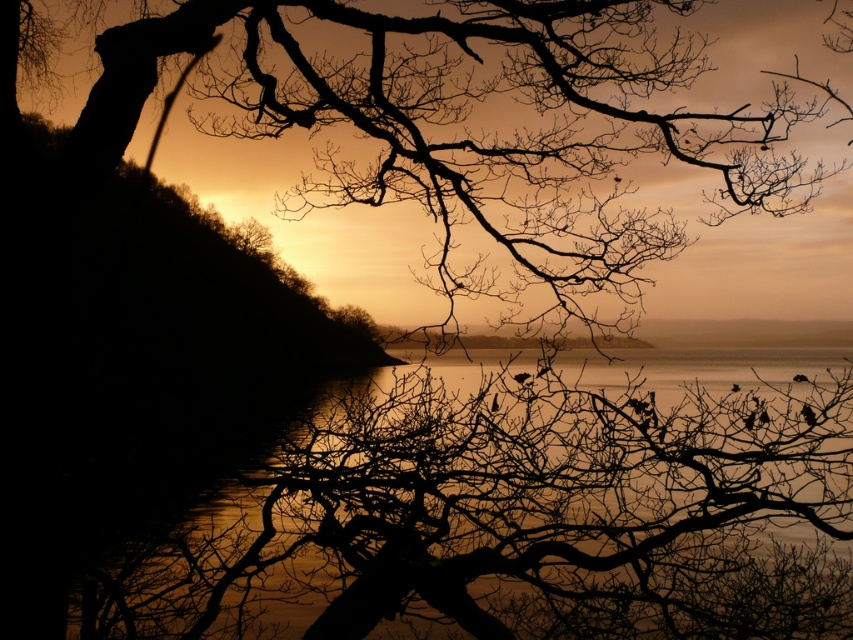
Does point (433, 576) lie in front of point (682, 58)?

Yes, point (433, 576) is in front of point (682, 58).

Between glossy water at center and silhouette bark tree at upper left, which one is positioned higher?

silhouette bark tree at upper left

Find the location of a particular element. glossy water at center is located at coordinates (514, 518).

Identify the location of glossy water at center. (514, 518).